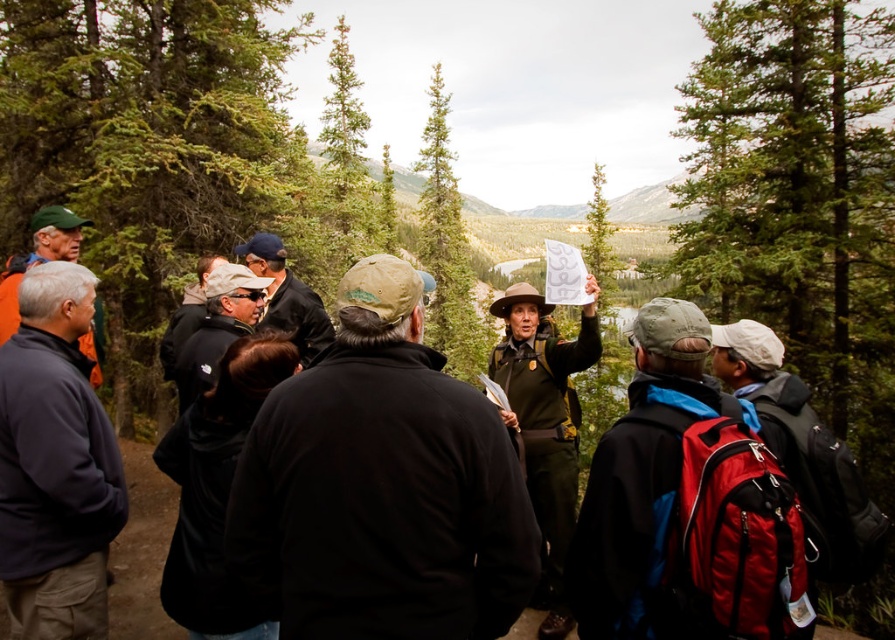
Question: Which object is farther from the camera taking this photo?

Choices:
 (A) dark blue fleece at left
 (B) green textured pine tree at center

Answer: (B)

Question: Can you confirm if dark blue fleece at left is smaller than green textured pine tree at center?

Choices:
 (A) yes
 (B) no

Answer: (A)

Question: Which point is farther to the camera?

Choices:
 (A) (79, 404)
 (B) (425, 122)

Answer: (B)

Question: Can you confirm if dark blue fleece at left is wider than green textured pine tree at center?

Choices:
 (A) no
 (B) yes

Answer: (A)

Question: Where is dark blue fleece at left located in relation to green textured pine tree at center in the image?

Choices:
 (A) left
 (B) right

Answer: (A)

Question: Which point is farther from the camera taking this photo?

Choices:
 (A) (473, 342)
 (B) (39, 408)

Answer: (A)